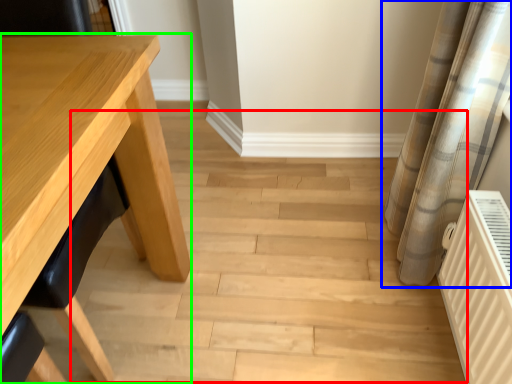
Question: Based on their relative distances, which object is nearer to stair (highlighted by a red box)? Choose from curtain (highlighted by a blue box) and table (highlighted by a green box).

Choices:
 (A) curtain
 (B) table

Answer: (A)